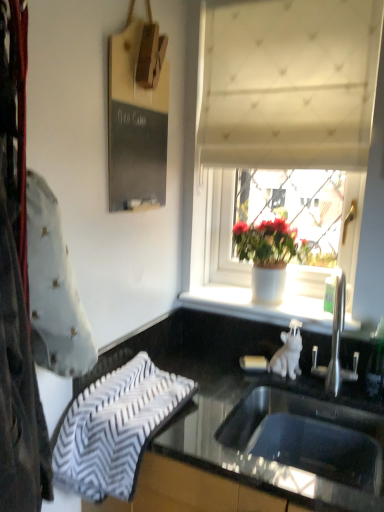
Question: Does black glossy countertop at lower center have a greater width compared to black chalkboard at upper left?

Choices:
 (A) yes
 (B) no

Answer: (A)

Question: From a real-world perspective, is black glossy countertop at lower center below black chalkboard at upper left?

Choices:
 (A) no
 (B) yes

Answer: (B)

Question: Is black glossy countertop at lower center next to black chalkboard at upper left and touching it?

Choices:
 (A) yes
 (B) no

Answer: (B)

Question: Considering the relative positions of black glossy countertop at lower center and black chalkboard at upper left in the image provided, is black glossy countertop at lower center in front of black chalkboard at upper left?

Choices:
 (A) no
 (B) yes

Answer: (B)

Question: Can you confirm if black glossy countertop at lower center is shorter than black chalkboard at upper left?

Choices:
 (A) yes
 (B) no

Answer: (B)

Question: Would you say black glossy countertop at lower center contains black chalkboard at upper left?

Choices:
 (A) yes
 (B) no

Answer: (B)

Question: Considering the relative sizes of white zigzag-patterned towel at lower left and stainless steel sink at lower center in the image provided, is white zigzag-patterned towel at lower left bigger than stainless steel sink at lower center?

Choices:
 (A) no
 (B) yes

Answer: (A)

Question: Is white zigzag-patterned towel at lower left not within stainless steel sink at lower center?

Choices:
 (A) no
 (B) yes

Answer: (B)

Question: From the image's perspective, is white zigzag-patterned towel at lower left below stainless steel sink at lower center?

Choices:
 (A) yes
 (B) no

Answer: (B)

Question: Considering the relative positions of white zigzag-patterned towel at lower left and stainless steel sink at lower center in the image provided, is white zigzag-patterned towel at lower left to the right of stainless steel sink at lower center from the viewer's perspective?

Choices:
 (A) yes
 (B) no

Answer: (B)

Question: Is white zigzag-patterned towel at lower left thinner than stainless steel sink at lower center?

Choices:
 (A) yes
 (B) no

Answer: (B)

Question: Is white zigzag-patterned towel at lower left positioned behind stainless steel sink at lower center?

Choices:
 (A) yes
 (B) no

Answer: (A)

Question: Can you confirm if white textured curtain at upper center is thinner than white zigzag-patterned towel at lower left?

Choices:
 (A) yes
 (B) no

Answer: (A)